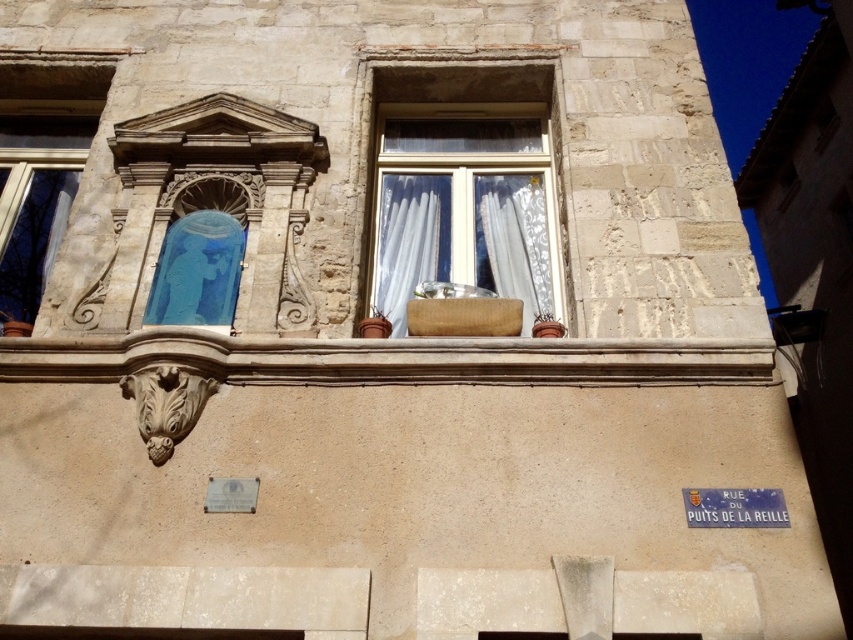
Question: Which point is farther to the camera?

Choices:
 (A) (492, 198)
 (B) (425, 156)

Answer: (B)

Question: Can you confirm if blue glass window at upper left is positioned to the left of blue glass window at center?

Choices:
 (A) yes
 (B) no

Answer: (A)

Question: Which of the following is the closest to the observer?

Choices:
 (A) (186, 246)
 (B) (410, 211)
 (C) (32, 237)

Answer: (A)

Question: Observing the image, what is the correct spatial positioning of blue glass window at upper left in reference to white lace curtain at upper center?

Choices:
 (A) right
 (B) left

Answer: (B)

Question: Which point is closer to the camera?

Choices:
 (A) (523, 273)
 (B) (393, 96)
 (C) (379, 280)
 (D) (752, 364)

Answer: (D)

Question: Can you confirm if blue glass window at center is positioned below white sheer curtain at center?

Choices:
 (A) yes
 (B) no

Answer: (A)